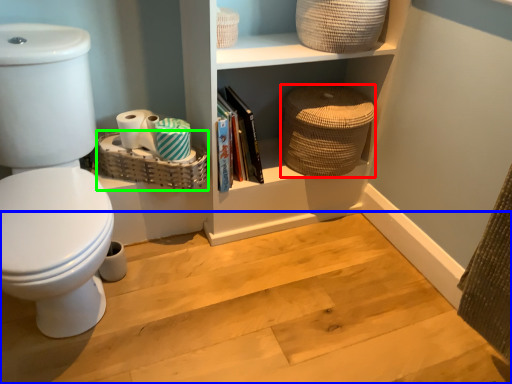
Question: Which is farther away from basket (highlighted by a red box)? stair (highlighted by a blue box) or basket (highlighted by a green box)?

Choices:
 (A) stair
 (B) basket

Answer: (A)